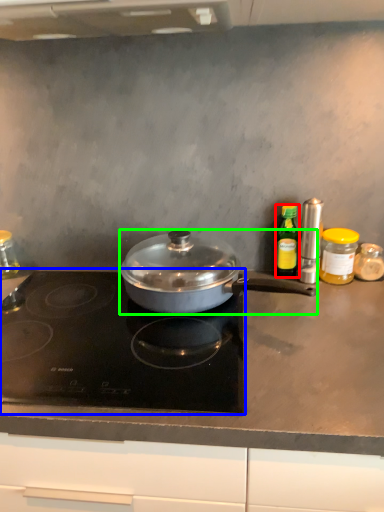
Question: Estimate the real-world distances between objects in this image. Which object is farther from kitchen appliance (highlighted by a red box), gas stove (highlighted by a blue box) or kitchen appliance (highlighted by a green box)?

Choices:
 (A) gas stove
 (B) kitchen appliance

Answer: (A)